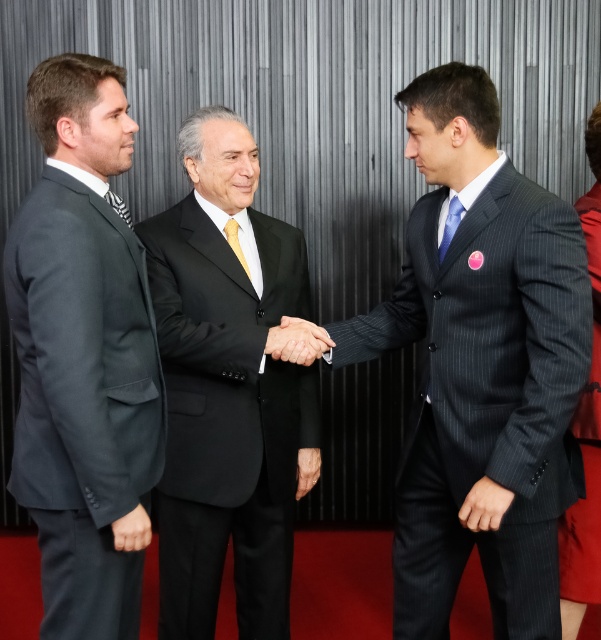
Question: Is black pinstripe suit at center to the right of striped fabric tie at left from the viewer's perspective?

Choices:
 (A) no
 (B) yes

Answer: (B)

Question: Does black pinstripe suit at center appear under striped fabric tie at left?

Choices:
 (A) no
 (B) yes

Answer: (B)

Question: Which point is closer to the camera?

Choices:
 (A) smooth black hand at center
 (B) yellow satin tie at center

Answer: (A)

Question: Which point appears closest to the camera in this image?

Choices:
 (A) (447, 220)
 (B) (310, 333)
 (C) (243, 268)
 (D) (218, 296)

Answer: (A)

Question: Which object appears farthest from the camera in this image?

Choices:
 (A) smooth black hand at center
 (B) black pinstripe suit at center
 (C) dark gray pinstripe suit at center

Answer: (B)

Question: Can you confirm if black pinstripe suit at center is positioned to the left of striped fabric tie at left?

Choices:
 (A) no
 (B) yes

Answer: (A)